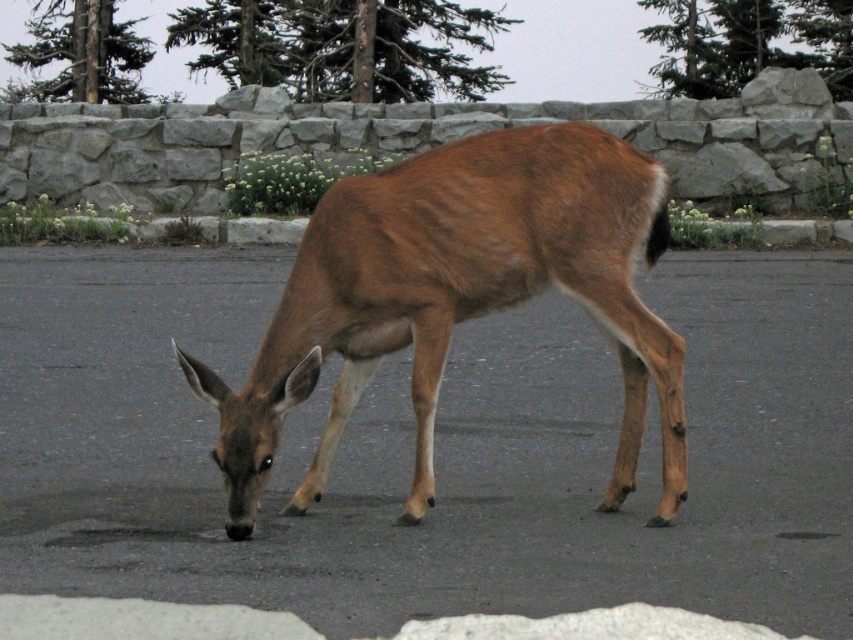
You are a photographer trying to capture the brown fur deer at center. The deer is represented by the point at coordinates point (434, 449). You want to place the deer in the center of your photo. Is the deer already centered in the image?

The brown fur deer at center is represented by point (434, 449), which corresponds to the center of the image, so yes, the deer is already centered.

You are a wildlife photographer aiming to capture the deer in the image. You notice two instances of the deer labeled as brown fur deer at center and brown furry deer at center. Which deer should you focus on to ensure your photo includes the deer that is higher up in the image?

The brown fur deer at center is located above the brown furry deer at center, so you should focus on the brown fur deer at center to capture the higher positioned deer.